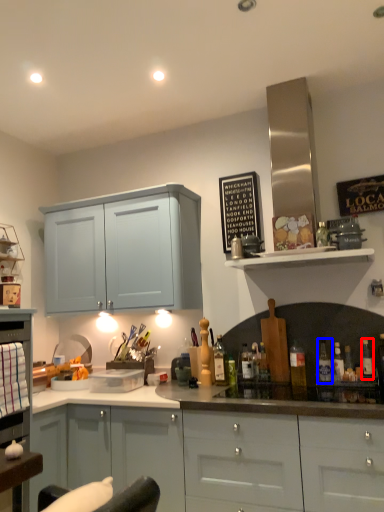
Question: Which point is closer to the camera, bottle (highlighted by a red box) or bottle (highlighted by a blue box)?

Choices:
 (A) bottle
 (B) bottle

Answer: (A)